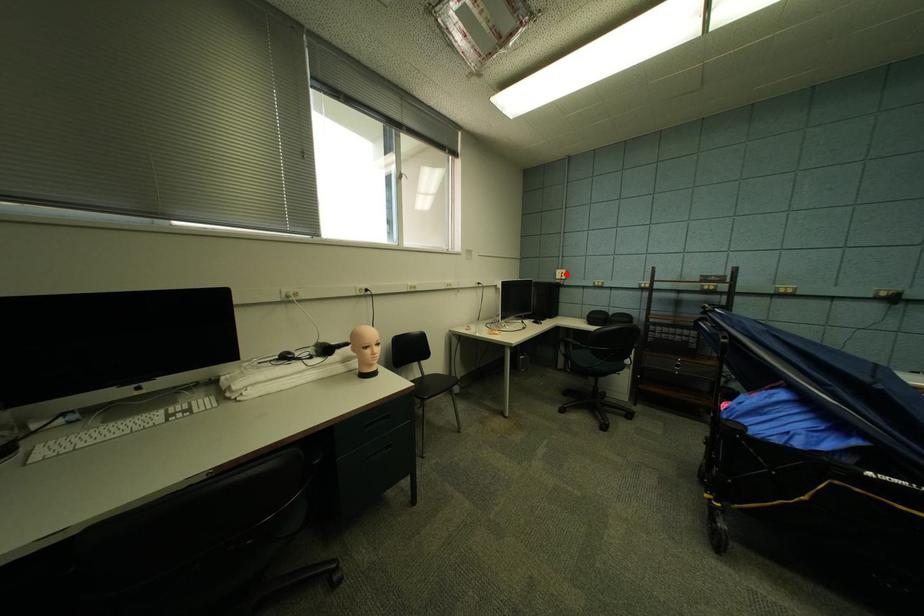
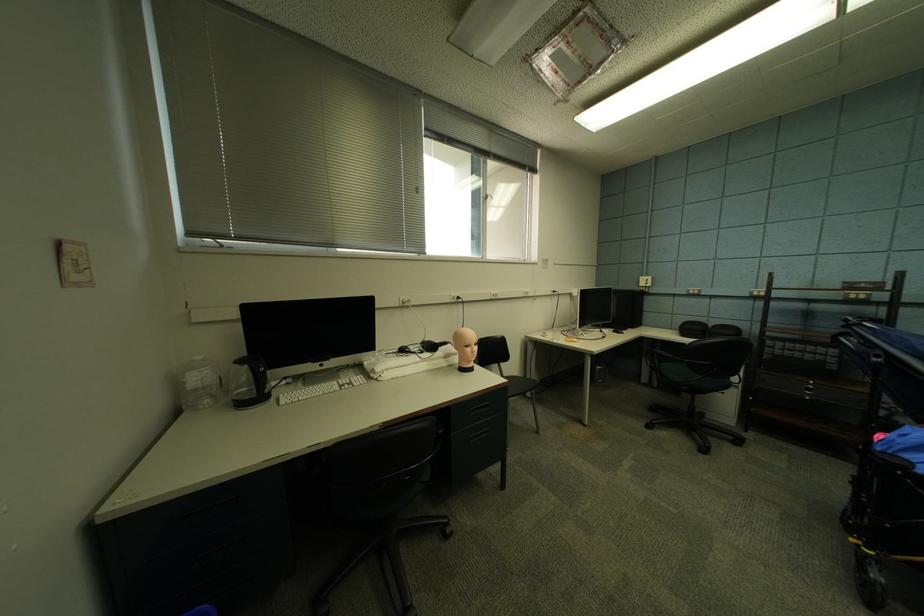
Question: I am providing you with two images of the same scene from different viewpoints. A red point is marked on the first image. Is the red point's position out of view in image 2?

Choices:
 (A) Yes
 (B) No

Answer: (B)